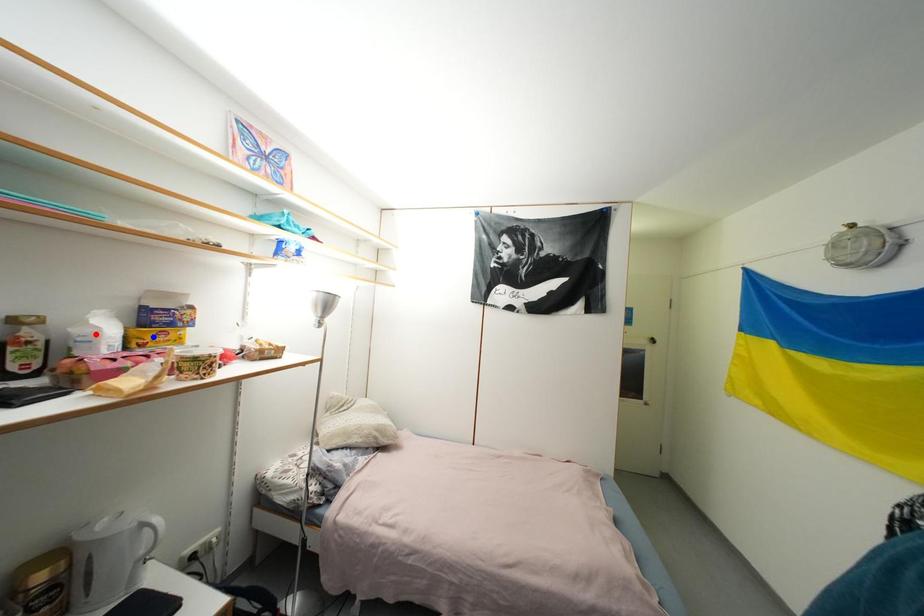
Question: Which of the two points in the image is closer to the camera?

Choices:
 (A) Blue point is closer.
 (B) Red point is closer.

Answer: (B)